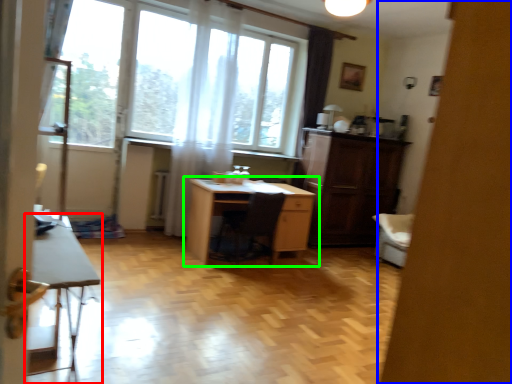
Question: Considering the real-world distances, which object is closest to table (highlighted by a red box)? screen door (highlighted by a blue box) or desk (highlighted by a green box).

Choices:
 (A) screen door
 (B) desk

Answer: (A)